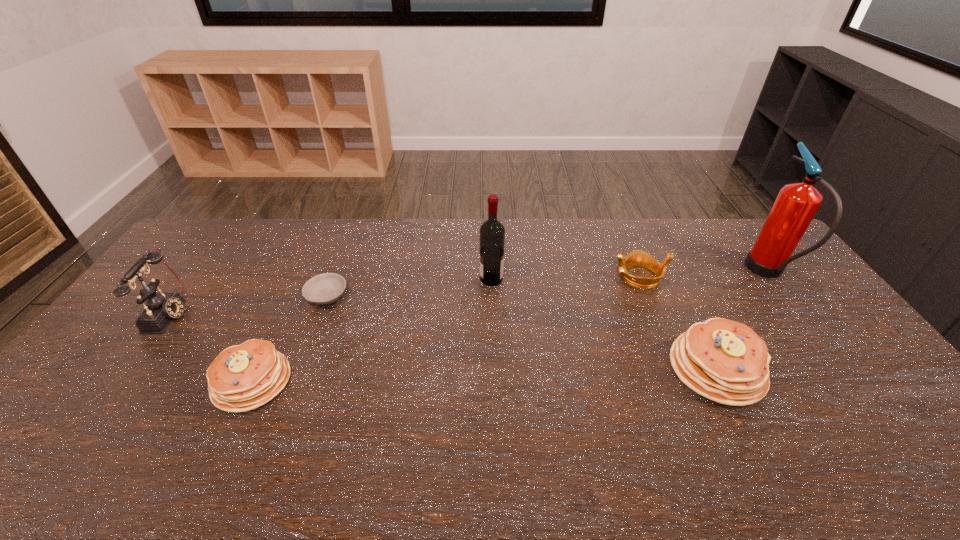
At what (x,y) coordinates should I click in order to perform the action: click on the second tallest object. Please return your answer as a coordinate pair (x, y). The image size is (960, 540). Looking at the image, I should click on (492, 232).

Where is `vacant position located on the back of the left pancake`? The image size is (960, 540). vacant position located on the back of the left pancake is located at coordinates (307, 263).

Where is `free space located on the left of the right pancake`? This screenshot has width=960, height=540. free space located on the left of the right pancake is located at coordinates (536, 369).

Find the location of a particular element. vacant region located 0.130m on the front of the tallest object is located at coordinates (813, 333).

Where is `free region located on the dial of the third tallest object`? This screenshot has width=960, height=540. free region located on the dial of the third tallest object is located at coordinates (311, 313).

Locate an element on the screen. The width and height of the screenshot is (960, 540). vacant space located 0.350m at the front emblem of the tiara is located at coordinates (509, 276).

Where is `free space located 0.090m at the front emblem of the tiara`? Image resolution: width=960 pixels, height=540 pixels. free space located 0.090m at the front emblem of the tiara is located at coordinates (586, 276).

Find the location of a particular element. Image resolution: width=960 pixels, height=540 pixels. blank area located 0.100m at the front emblem of the tiara is located at coordinates (583, 276).

Identify the location of vacant area situated on the right of the shortest object. The height and width of the screenshot is (540, 960). (372, 296).

Identify the location of vacant area situated 0.140m on the front and back of the alcohol. (438, 279).